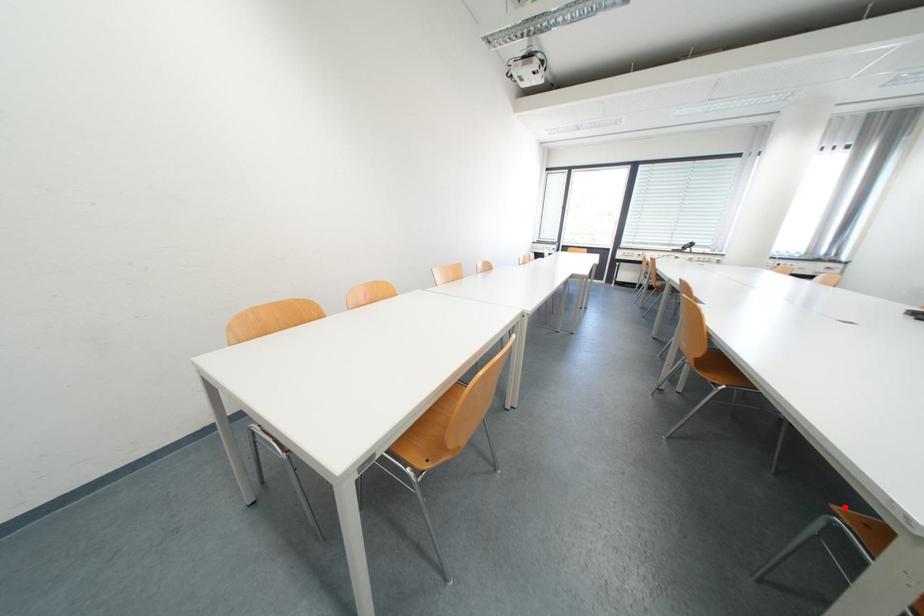
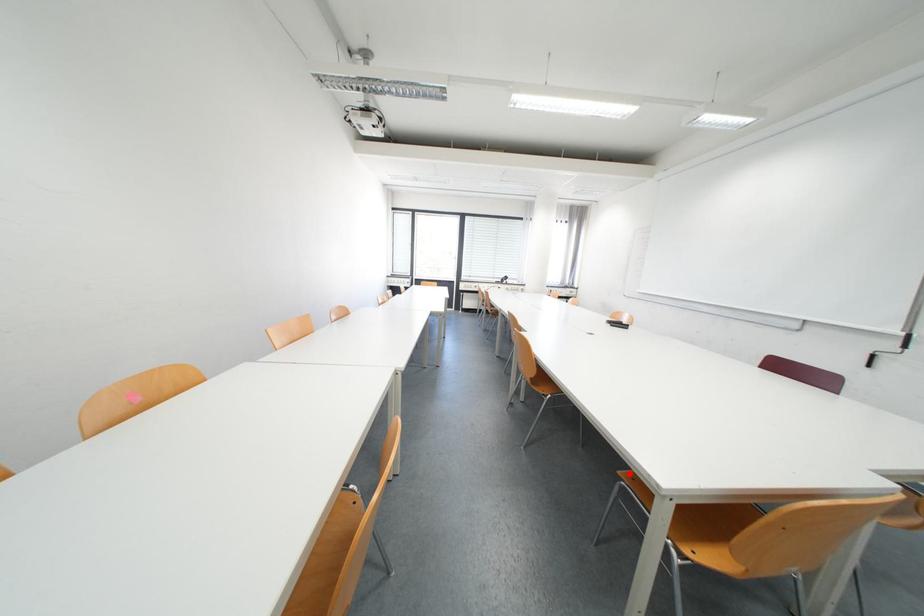
I am providing you with two images of the same scene from different viewpoints. A red point is marked on the first image and another point is marked on the second image. Is the red point in image1 aligned with the point shown in image2?

Yes